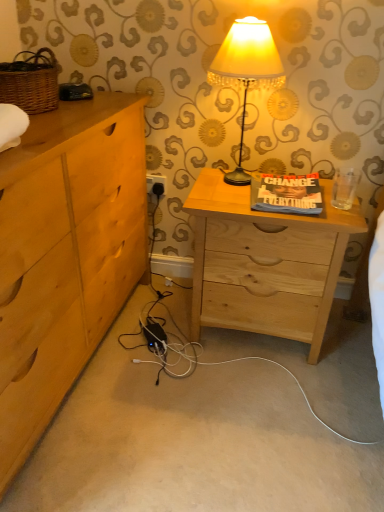
Question: Which is correct: matte cream lampshade at center is inside white plastic electric outlet at lower center, or outside of it?

Choices:
 (A) inside
 (B) outside

Answer: (B)

Question: Considering the positions of matte cream lampshade at center and white plastic electric outlet at lower center in the image, is matte cream lampshade at center taller or shorter than white plastic electric outlet at lower center?

Choices:
 (A) tall
 (B) short

Answer: (A)

Question: Which is farther from the white plastic electric outlet at lower center?

Choices:
 (A) matte cream lampshade at center
 (B) natural wood nightstand at center
 (C) light wood chest of drawers at left

Answer: (C)

Question: Considering the real-world distances, which object is farthest from the natural wood nightstand at center?

Choices:
 (A) light wood chest of drawers at left
 (B) matte cream lampshade at center
 (C) white plastic electric outlet at lower center

Answer: (C)